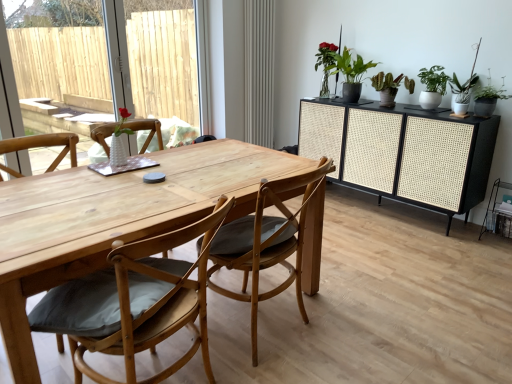
The width and height of the screenshot is (512, 384). Identify the location of free space to the right of natural wood chair at center, arranged as the second chair when viewed from the left. (361, 330).